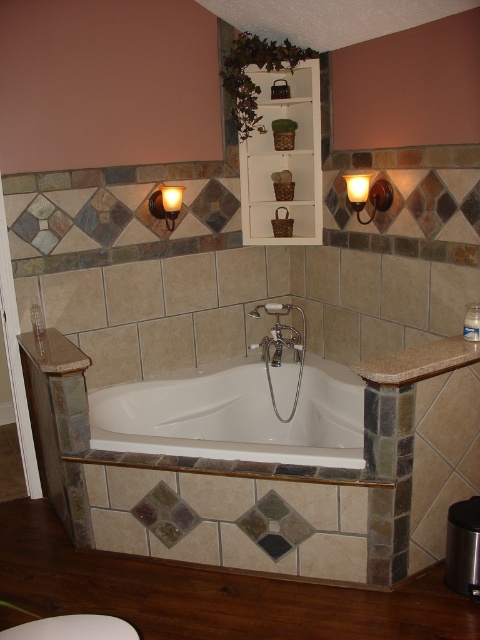
Question: Does white glossy bathtub at center lie behind white glossy toilet bowl at lower left?

Choices:
 (A) no
 (B) yes

Answer: (B)

Question: Does white glossy bathtub at center appear on the left side of white glossy toilet bowl at lower left?

Choices:
 (A) no
 (B) yes

Answer: (A)

Question: Which is farther from the matte gold sconce at upper right?

Choices:
 (A) matte gold sconce at upper left
 (B) white glossy bathtub at center

Answer: (B)

Question: Among these points, which one is nearest to the camera?

Choices:
 (A) (112, 436)
 (B) (179, 204)
 (C) (360, 177)
 (D) (72, 628)

Answer: (D)

Question: From the image, what is the correct spatial relationship of white glossy bathtub at center in relation to white glossy toilet bowl at lower left?

Choices:
 (A) above
 (B) below

Answer: (A)

Question: Which of the following is the closest to the observer?

Choices:
 (A) (180, 202)
 (B) (196, 422)
 (C) (386, 184)
 (D) (96, 624)

Answer: (D)